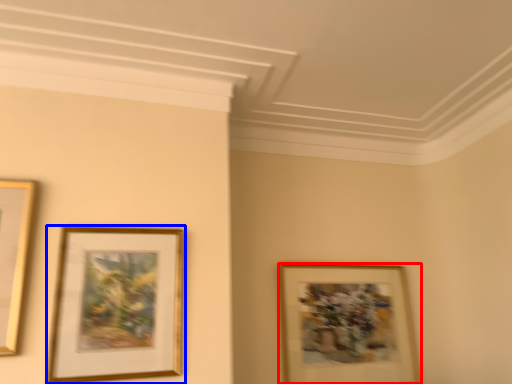
Question: Which point is closer to the camera, picture frame (highlighted by a red box) or picture frame (highlighted by a blue box)?

Choices:
 (A) picture frame
 (B) picture frame

Answer: (B)